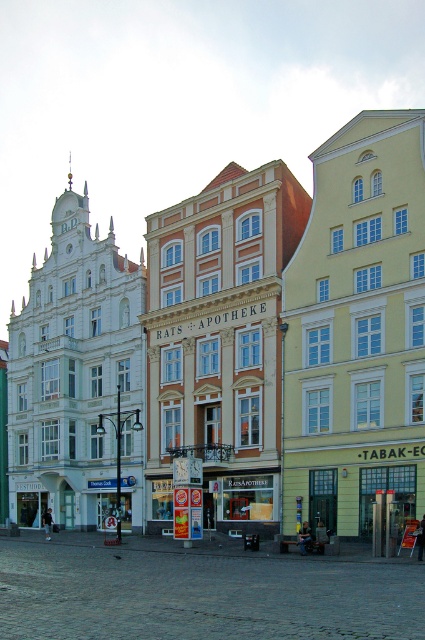
Question: Is matte white building at center positioned behind matte glass storefront at center?

Choices:
 (A) yes
 (B) no

Answer: (B)

Question: Does matte white building at center appear over matte glass storefront at center?

Choices:
 (A) yes
 (B) no

Answer: (A)

Question: Can you confirm if matte white building at center is positioned to the right of matte glass storefront at center?

Choices:
 (A) no
 (B) yes

Answer: (A)

Question: Which object appears farthest from the camera in this image?

Choices:
 (A) matte glass storefront at center
 (B) matte white building at center

Answer: (A)